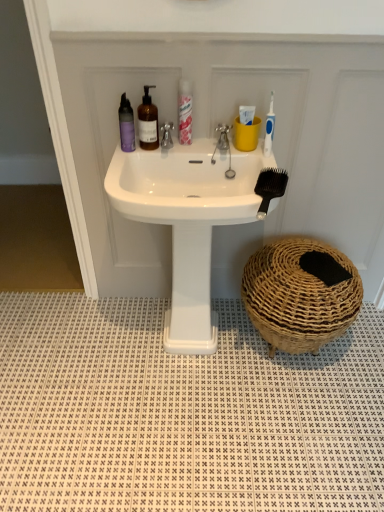
Locate an element on the screen. The image size is (384, 512). vacant space situated on the left part of white glossy sink at center is located at coordinates (81, 349).